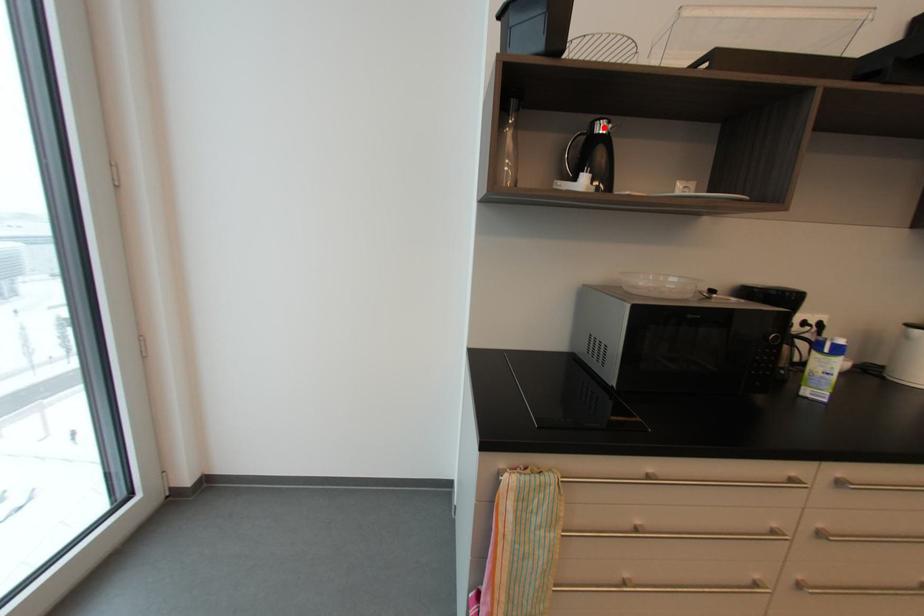
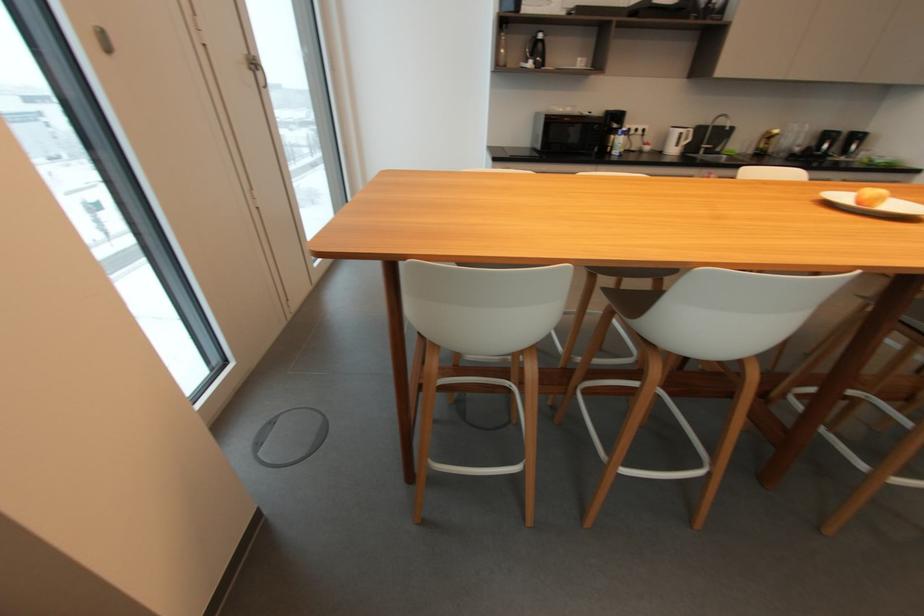
Find the pixel in the second image that matches the highlighted location in the first image.

(544, 36)